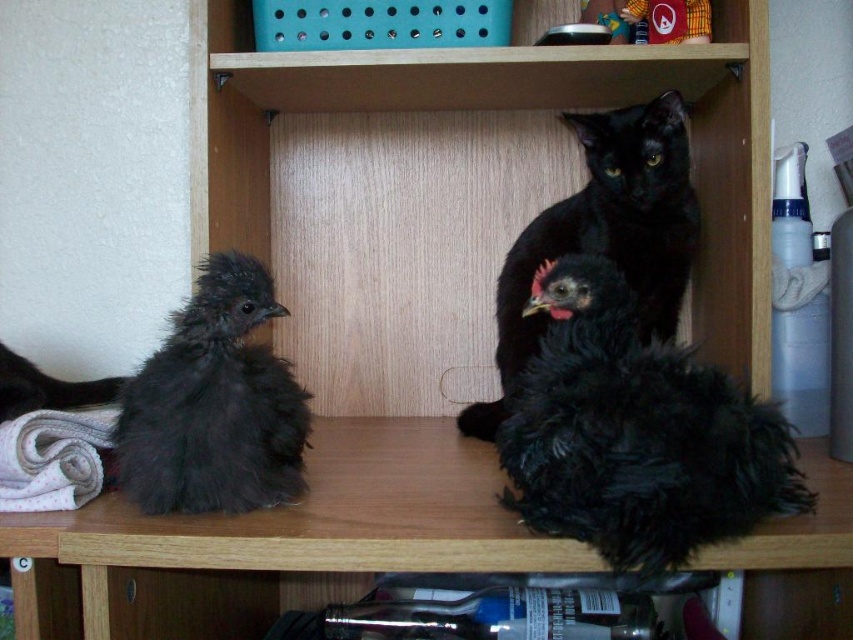
Question: Can you confirm if dark fluffy chicken at left is positioned to the left of black fluffy cat at upper center?

Choices:
 (A) no
 (B) yes

Answer: (B)

Question: Which point appears farthest from the camera in this image?

Choices:
 (A) (763, 481)
 (B) (698, 6)
 (C) (252, 468)
 (D) (675, 225)

Answer: (D)

Question: Estimate the real-world distances between objects in this image. Which object is farther from the black fluffy chicken at center?

Choices:
 (A) dark fluffy chicken at left
 (B) black fluffy cat at upper center
 (C) smooth yellow fabric at upper center

Answer: (C)

Question: Does dark fluffy chicken at left come behind smooth yellow fabric at upper center?

Choices:
 (A) yes
 (B) no

Answer: (B)

Question: Is black fluffy chicken at center bigger than black fluffy cat at upper center?

Choices:
 (A) yes
 (B) no

Answer: (B)

Question: Considering the real-world distances, which object is farthest from the smooth yellow fabric at upper center?

Choices:
 (A) black fluffy chicken at center
 (B) dark fluffy chicken at left

Answer: (B)